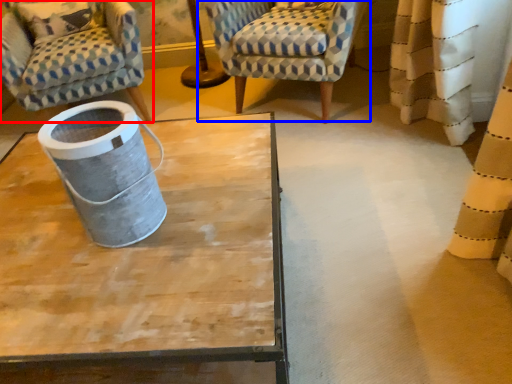
Question: Among these objects, which one is nearest to the camera, chair (highlighted by a red box) or chair (highlighted by a blue box)?

Choices:
 (A) chair
 (B) chair

Answer: (B)